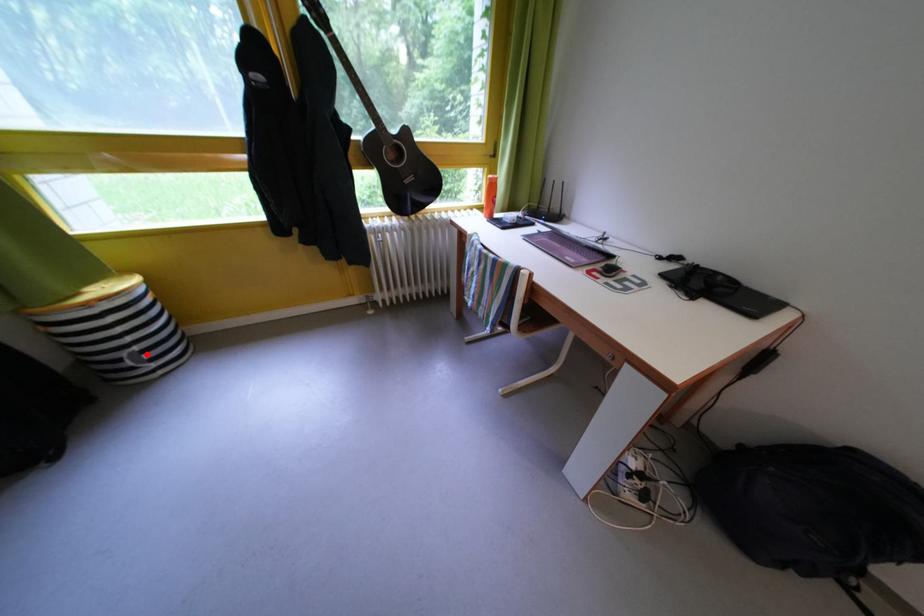
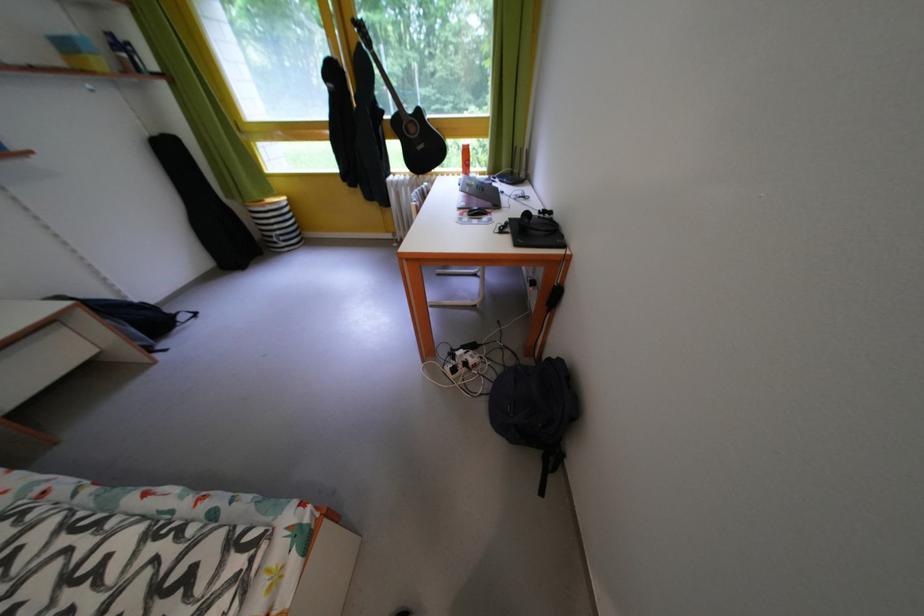
Question: A red point is marked in image1. In image2, is the corresponding 3D point closer to the camera or farther? Reply with the corresponding letter.

Choices:
 (A) The corresponding 3D point is closer.
 (B) The corresponding 3D point is farther.

Answer: (B)